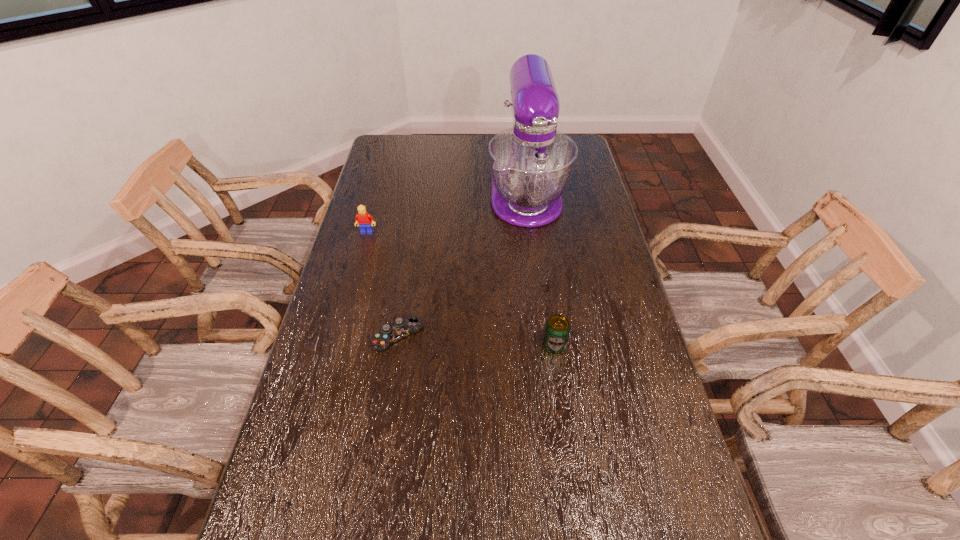
The height and width of the screenshot is (540, 960). Identify the location of free space that satisfies the following two spatial constraints: 1. on the front side of the beer can; 2. on the right side of the shortest object. (396, 345).

Find the location of `free space that satisfies the following two spatial constraints: 1. at the bowl opening of the tallest object; 2. on the left side of the beer can`. free space that satisfies the following two spatial constraints: 1. at the bowl opening of the tallest object; 2. on the left side of the beer can is located at coordinates (544, 345).